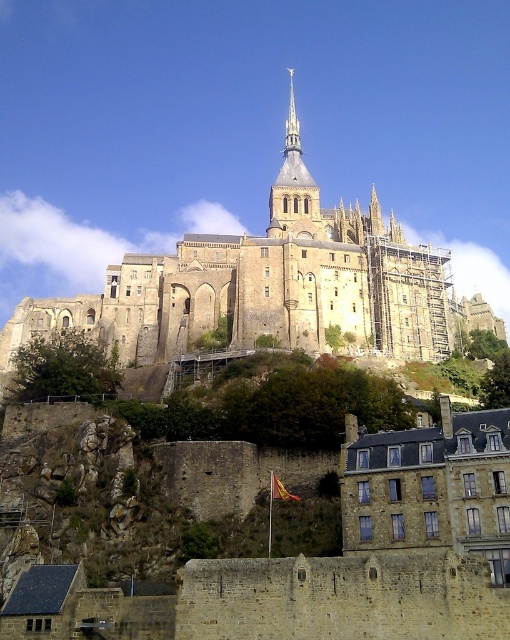
Question: Is brown stone castle at center to the right of shiny silver spire at upper center from the viewer's perspective?

Choices:
 (A) yes
 (B) no

Answer: (B)

Question: Is brown stone castle at center to the left of shiny silver spire at upper center from the viewer's perspective?

Choices:
 (A) no
 (B) yes

Answer: (B)

Question: Among these points, which one is nearest to the camera?

Choices:
 (A) (477, 317)
 (B) (296, 120)

Answer: (A)

Question: Can you confirm if brown stone castle at center is thinner than shiny silver spire at upper center?

Choices:
 (A) yes
 (B) no

Answer: (B)

Question: Which point is farther to the camera?

Choices:
 (A) (133, 317)
 (B) (291, 99)

Answer: (B)